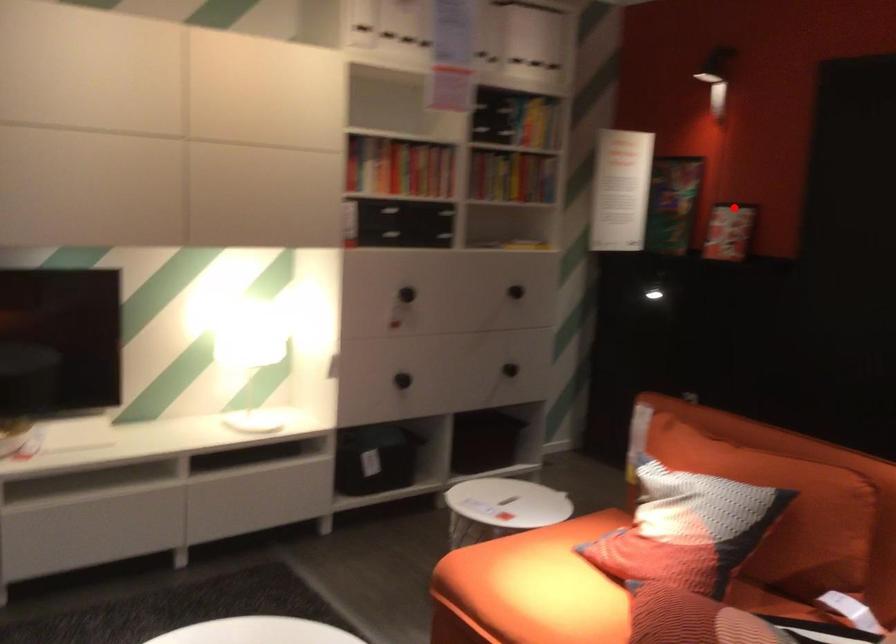
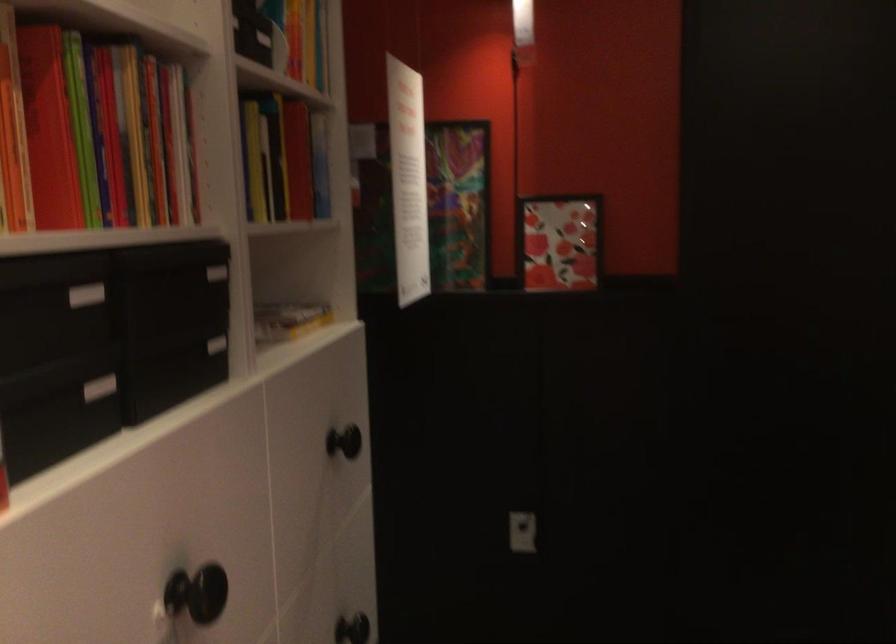
Locate, in the second image, the point that corresponds to the highlighted location in the first image.

(560, 242)